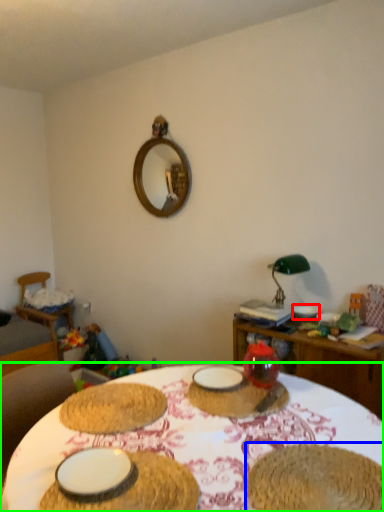
Question: Which object is positioned farthest from tableware (highlighted by a red box)? Select from food (highlighted by a blue box) and table (highlighted by a green box).

Choices:
 (A) food
 (B) table

Answer: (A)